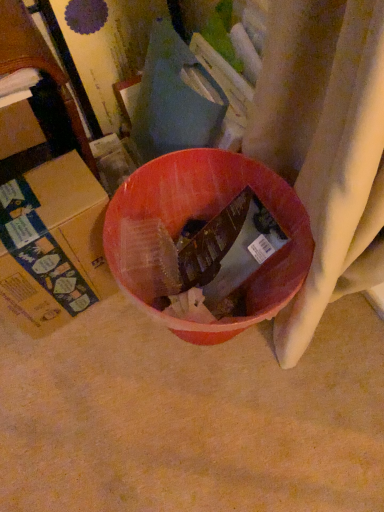
Question: Which is correct: cardboard box at left, which is counted as the second cardboard box, starting from the bottom, is inside cardboard box at left, positioned as the second cardboard box in top-to-bottom order, or outside of it?

Choices:
 (A) outside
 (B) inside

Answer: (A)

Question: From the image's perspective, is cardboard box at left, which is counted as the second cardboard box, starting from the bottom, located above or below cardboard box at left, positioned as the second cardboard box in top-to-bottom order?

Choices:
 (A) below
 (B) above

Answer: (B)

Question: From a real-world perspective, relative to cardboard box at left, positioned as the second cardboard box in top-to-bottom order, is cardboard box at left, marked as the 1th cardboard box in a top-to-bottom arrangement, vertically above or below?

Choices:
 (A) below
 (B) above

Answer: (B)

Question: Considering the positions of cardboard box at left, positioned as the second cardboard box in top-to-bottom order, and cardboard box at left, marked as the 1th cardboard box in a top-to-bottom arrangement, in the image, is cardboard box at left, positioned as the second cardboard box in top-to-bottom order, taller or shorter than cardboard box at left, marked as the 1th cardboard box in a top-to-bottom arrangement,?

Choices:
 (A) short
 (B) tall

Answer: (B)

Question: In terms of width, does cardboard box at left, positioned as the second cardboard box in top-to-bottom order, look wider or thinner when compared to cardboard box at left, marked as the 1th cardboard box in a top-to-bottom arrangement?

Choices:
 (A) thin
 (B) wide

Answer: (B)

Question: From the image's perspective, is cardboard box at left, the 1th cardboard box from the bottom, positioned above or below cardboard box at left, marked as the 1th cardboard box in a top-to-bottom arrangement?

Choices:
 (A) above
 (B) below

Answer: (B)

Question: Visually, is cardboard box at left, positioned as the second cardboard box in top-to-bottom order, positioned to the left or to the right of cardboard box at left, which is counted as the second cardboard box, starting from the bottom?

Choices:
 (A) left
 (B) right

Answer: (B)